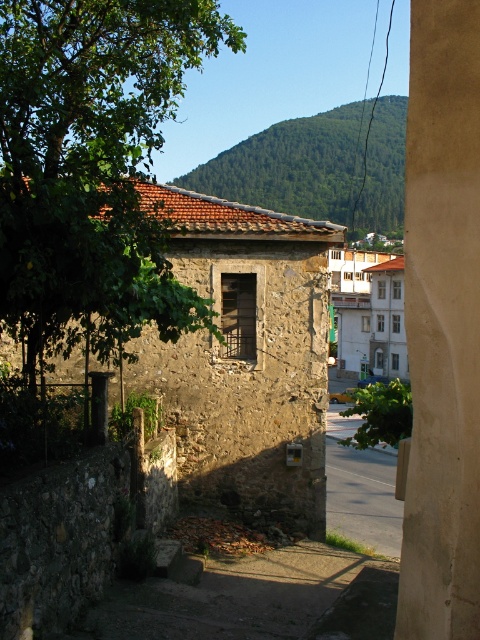
You are standing 15 feet away from the stone building. There is a green leafy tree at upper left. Can you reach the tree without moving closer to it?

The green leafy tree at upper left is 17.02 feet away from you. Since you are only 15 feet away from the stone building, you are closer to the building than the tree. Therefore, you cannot reach the tree without moving closer.